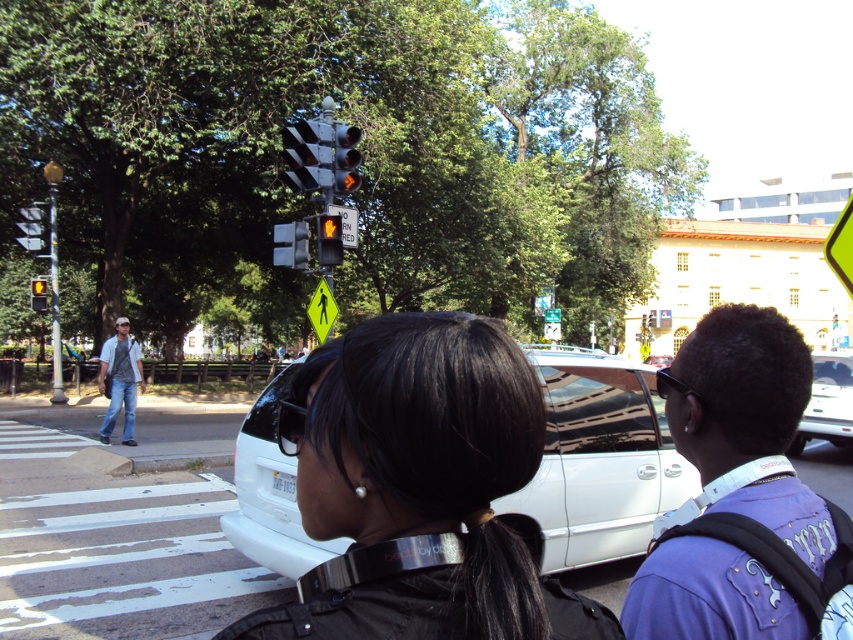
Question: Which of these objects is positioned farthest from the yellow matte traffic light at upper left?

Choices:
 (A) white matte van at center
 (B) metallic orange traffic light at upper center
 (C) green reflective pedestrian at upper center

Answer: (A)

Question: Which object is farther from the camera taking this photo?

Choices:
 (A) black matte hair at center
 (B) yellow matte traffic light at upper left

Answer: (B)

Question: From the image, what is the correct spatial relationship of purple fabric shirt at center right in relation to yellow matte pedestrian signal at upper center?

Choices:
 (A) below
 (B) above

Answer: (A)

Question: Does purple fabric shirt at center right appear over yellow reflective pedestrian crossing sign at upper center?

Choices:
 (A) no
 (B) yes

Answer: (A)

Question: Where is purple fabric shirt at center right located in relation to yellow matte pedestrian signal at upper center in the image?

Choices:
 (A) below
 (B) above

Answer: (A)

Question: Which point appears farthest from the camera in this image?

Choices:
 (A) (521, 554)
 (B) (811, 428)

Answer: (B)